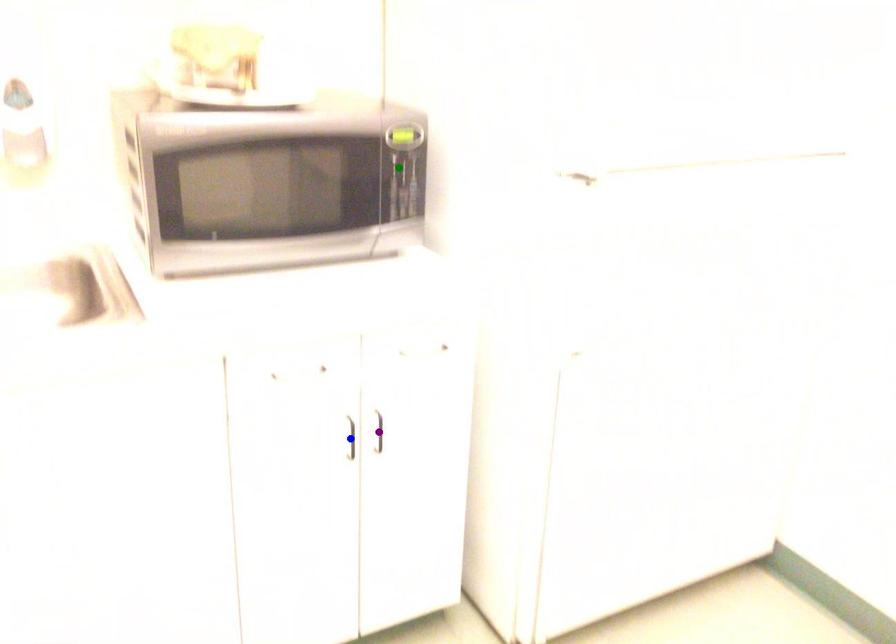
Order these from farthest to nearest:
1. blue point
2. purple point
3. green point

green point < purple point < blue point